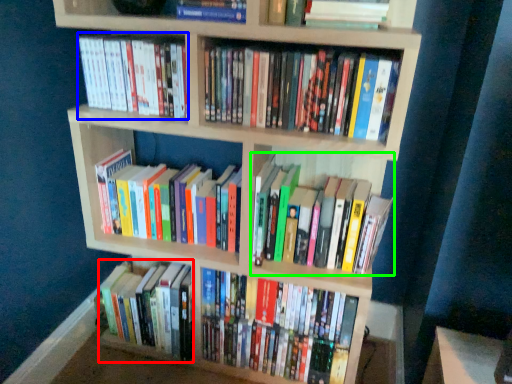
Question: Which is farther away from book (highlighted by a red box)? book (highlighted by a blue box) or book (highlighted by a green box)?

Choices:
 (A) book
 (B) book

Answer: (A)